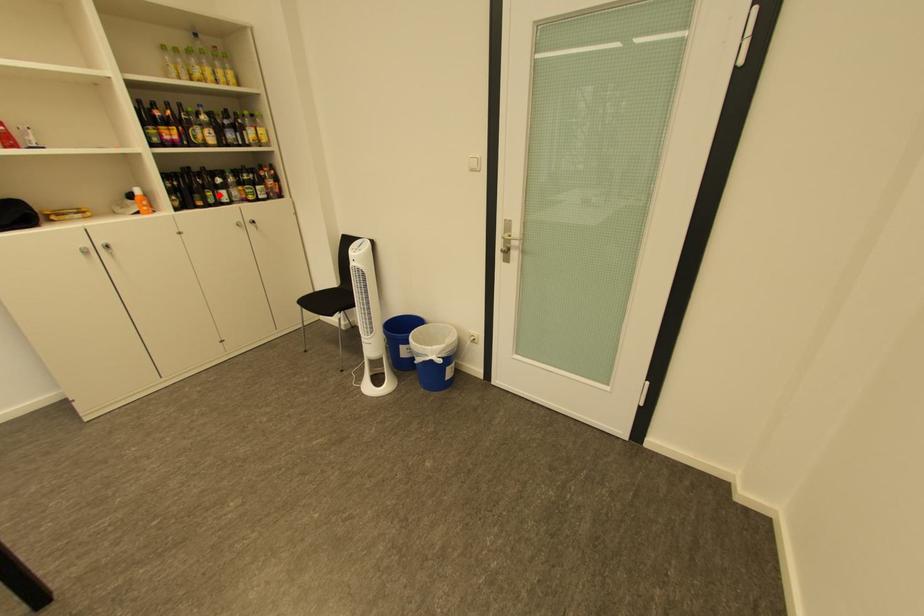
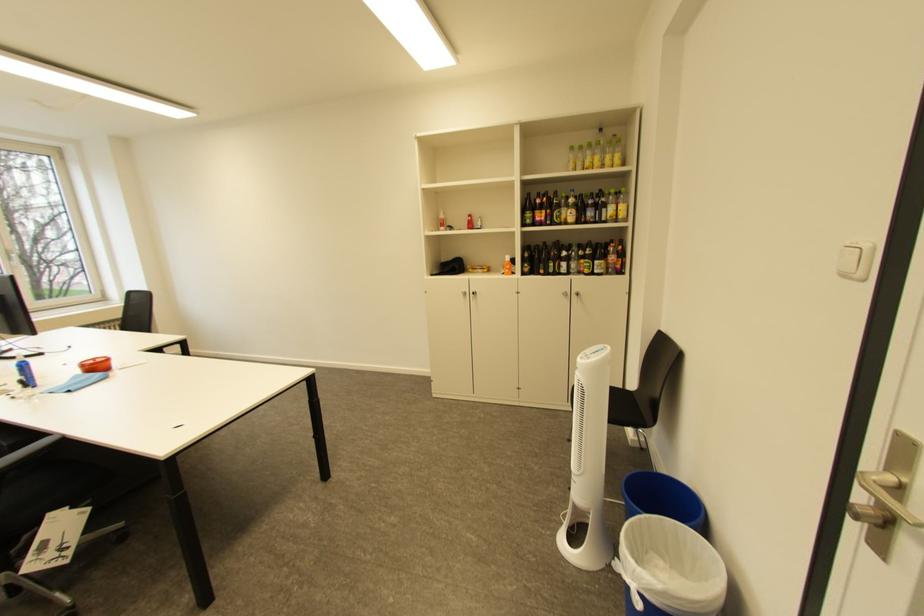
The point at the highlighted location is marked in the first image. Where is the corresponding point in the second image?

(562, 265)